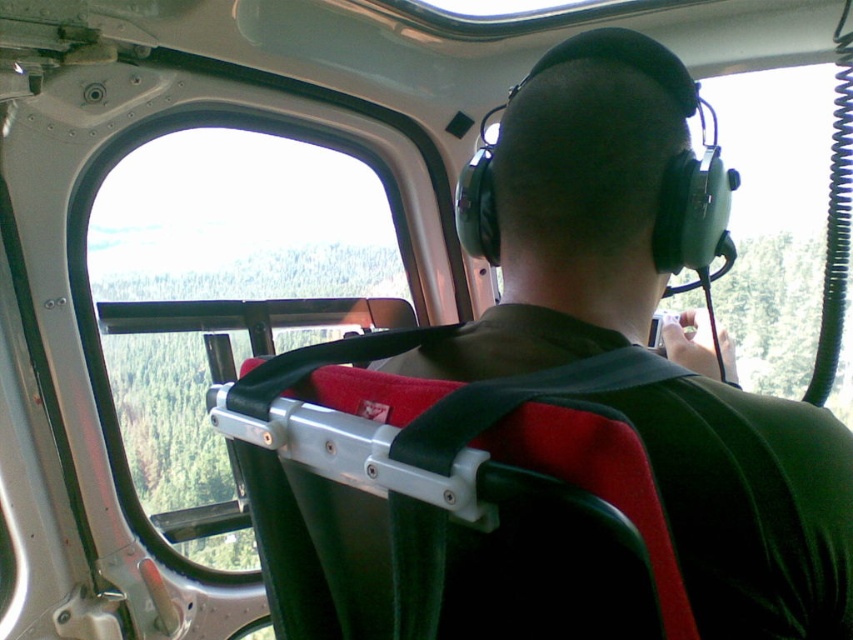
You are a passenger in the helicopter and want to take a photo through the window. The green fabric strap at center is blocking your view. Which object should you move to the right to get a clear view through the transparent glass window at upper left?

You should move the green fabric strap at center to the right so that it is no longer blocking the transparent glass window at upper left, which is to the left of it.

You are a passenger in the helicopter and want to take a photo through the window. Which object, the transparent glass window at upper left or the green fabric strap at center, has a wider opening to frame your shot?

The transparent glass window at upper left has a larger width than the green fabric strap at center, so it provides a wider opening to frame your shot.

You are a passenger in the helicopter and want to take a photo through the transparent glass window at upper left. Your camera is hanging on the green fabric strap at center. Can you reach the camera while holding the strap to take the photo?

The transparent glass window at upper left and green fabric strap at center are 5.61 feet apart. Since the distance between them is 5.61 feet, it may be challenging to reach the camera on the green fabric strap at center while holding onto the transparent glass window at upper left, depending on your arm length.